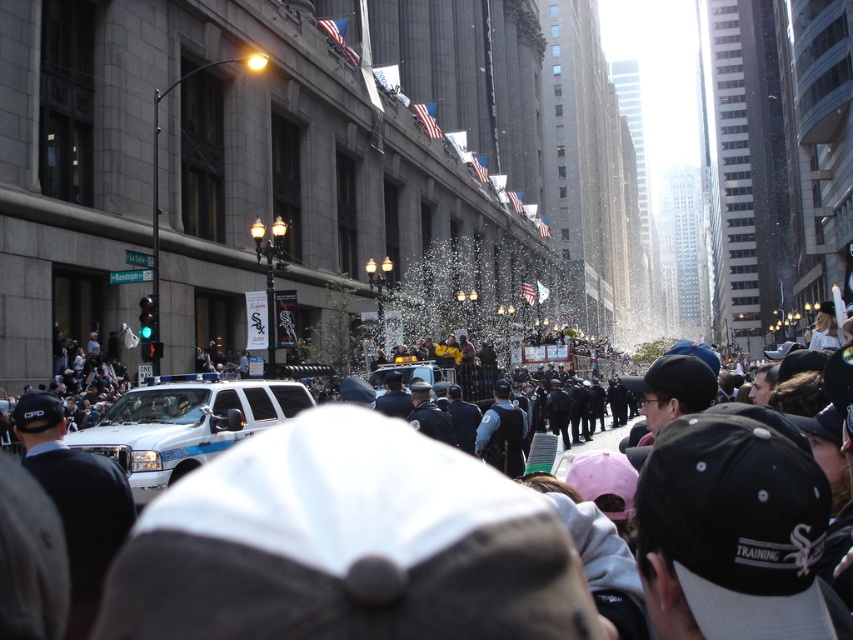
Does white glossy suv at center appear under shiny metallic confetti at center?

Indeed, white glossy suv at center is positioned under shiny metallic confetti at center.

Between white glossy suv at center and shiny metallic confetti at center, which one appears on the right side from the viewer's perspective?

From the viewer's perspective, shiny metallic confetti at center appears more on the right side.

Who is more distant from viewer, (263, 392) or (422, 324)?

The point (422, 324) is behind.

Locate an element on the screen. The width and height of the screenshot is (853, 640). white glossy suv at center is located at coordinates (184, 426).

Can you confirm if shiny metallic confetti at center is smaller than white glossy police car at center?

Actually, shiny metallic confetti at center might be larger than white glossy police car at center.

Who is shorter, shiny metallic confetti at center or white glossy police car at center?

white glossy police car at center

Is point (450, 241) behind point (421, 365)?

That is True.

Locate an element on the screen. The image size is (853, 640). shiny metallic confetti at center is located at coordinates (463, 300).

This screenshot has width=853, height=640. What do you see at coordinates (184, 426) in the screenshot?
I see `white glossy suv at center` at bounding box center [184, 426].

Can you confirm if white glossy suv at center is bigger than white glossy police car at center?

Correct, white glossy suv at center is larger in size than white glossy police car at center.

Is point (131, 436) more distant than point (381, 394)?

That is False.

Where is `white glossy suv at center`? white glossy suv at center is located at coordinates (184, 426).